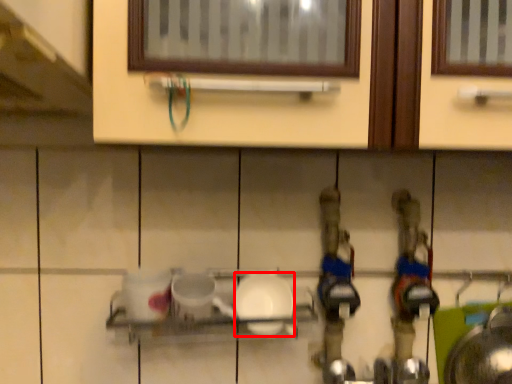
Question: From the image's perspective, what is the correct spatial relationship of tableware (annotated by the red box) in relation to shelf?

Choices:
 (A) above
 (B) below

Answer: (A)